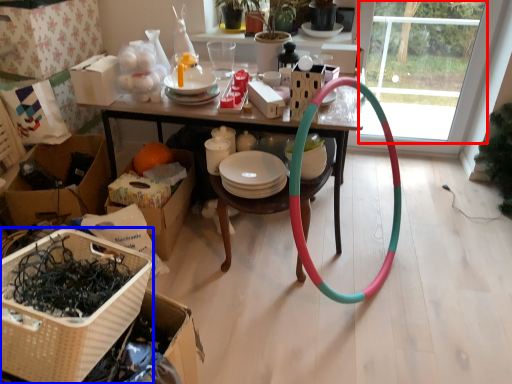
Question: Which object appears closest to the camera in this image, glass door (highlighted by a red box) or basket (highlighted by a blue box)?

Choices:
 (A) glass door
 (B) basket

Answer: (B)